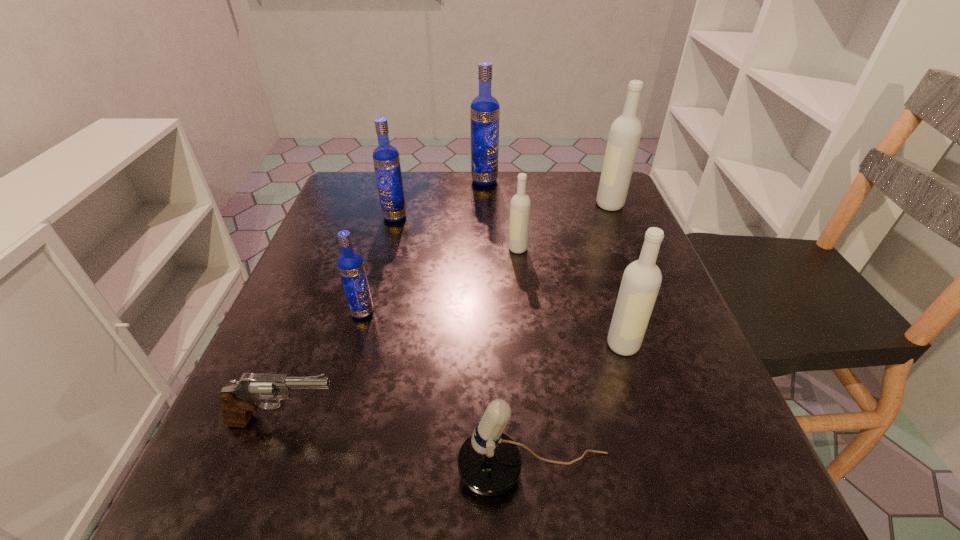
You are a GUI agent. You are given a task and a screenshot of the screen. Output one action in this format:
    pyautogui.click(x=<x>, y=<y>)
    Task: Click on the white vodka that is the closest one to the second nearest blue vodka
    The height and width of the screenshot is (540, 960).
    Given the screenshot: What is the action you would take?
    pyautogui.click(x=520, y=205)

Select which white vodka is the closest to the second smallest blue vodka. Please provide its 2D coordinates. Your answer should be formatted as a tuple, i.e. [(x, y)], where the tuple contains the x and y coordinates of a point satisfying the conditions above.

[(520, 205)]

Image resolution: width=960 pixels, height=540 pixels. I want to click on free space that satisfies the following two spatial constraints: 1. on the front side of the microphone; 2. on the right side of the biggest blue vodka, so click(490, 471).

At what (x,y) coordinates should I click in order to perform the action: click on vacant region that satisfies the following two spatial constraints: 1. on the front side of the rightmost vodka; 2. at the barrel of the second nearest object. Please return your answer as a coordinate pair (x, y). The width and height of the screenshot is (960, 540). Looking at the image, I should click on (700, 421).

Locate an element on the screen. free region that satisfies the following two spatial constraints: 1. on the back side of the farthest object; 2. on the right side of the second farthest blue vodka is located at coordinates (404, 180).